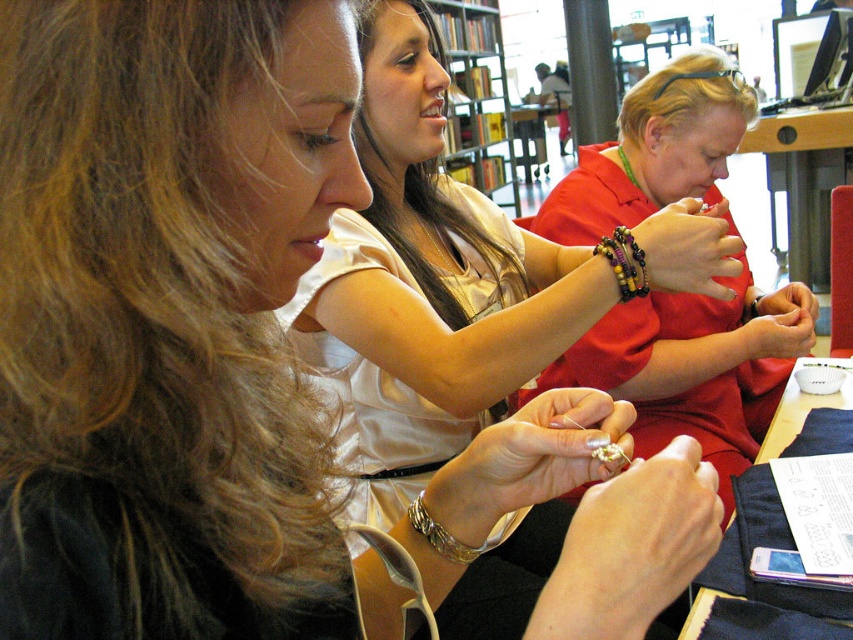
Based on the photo, is wooden bookshelf at upper center wider than multicolored beaded bracelet at center?

Correct, the width of wooden bookshelf at upper center exceeds that of multicolored beaded bracelet at center.

Looking at this image, can you confirm if wooden bookshelf at upper center is positioned above multicolored beaded bracelet at center?

Correct, wooden bookshelf at upper center is located above multicolored beaded bracelet at center.

Describe the element at coordinates (477, 97) in the screenshot. I see `wooden bookshelf at upper center` at that location.

At what (x,y) coordinates should I click in order to perform the action: click on wooden bookshelf at upper center. Please return your answer as a coordinate pair (x, y). Looking at the image, I should click on (477, 97).

Identify the location of wooden bookshelf at upper center. The image size is (853, 640). (477, 97).

Can you confirm if wooden bookshelf at upper center is positioned to the left of gold metallic bracelet at lower center?

No, wooden bookshelf at upper center is not to the left of gold metallic bracelet at lower center.

Is point (482, 32) positioned behind point (468, 547)?

Yes, point (482, 32) is behind point (468, 547).

Where is `wooden bookshelf at upper center`? This screenshot has width=853, height=640. wooden bookshelf at upper center is located at coordinates (477, 97).

In order to click on matte red blouse at center in this screenshot , I will do `click(695, 368)`.

What do you see at coordinates (695, 368) in the screenshot? This screenshot has width=853, height=640. I see `matte red blouse at center` at bounding box center [695, 368].

Is point (670, 138) farther from camera compared to point (628, 298)?

Yes, point (670, 138) is farther from viewer.

Where is `matte red blouse at center`? This screenshot has width=853, height=640. matte red blouse at center is located at coordinates (695, 368).